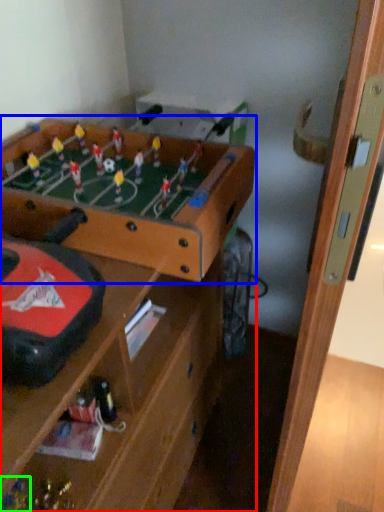
Question: Which is nearer to the table (highlighted by a red box)? table (highlighted by a blue box) or toy (highlighted by a green box).

Choices:
 (A) table
 (B) toy

Answer: (A)